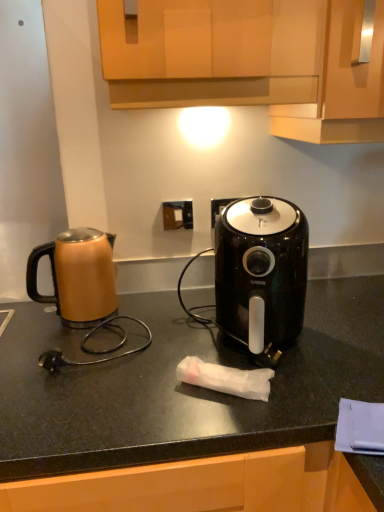
Image resolution: width=384 pixels, height=512 pixels. I want to click on vacant area that is in front of black glossy air fryer at center, so click(x=272, y=411).